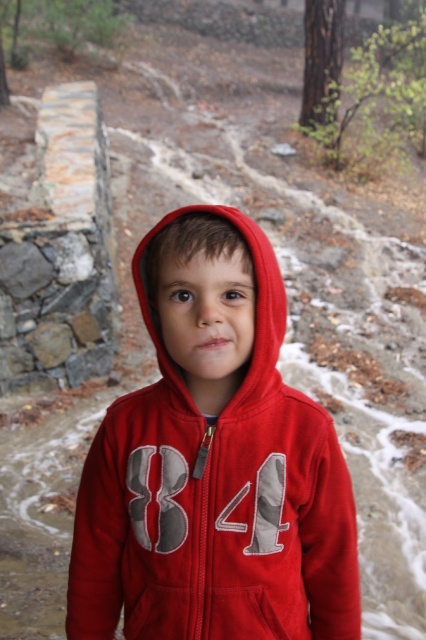
Question: Which of the following is the closest to the observer?

Choices:
 (A) matte fleece hoodie at center
 (B) red fleece hoodie at center

Answer: (A)

Question: Does matte fleece hoodie at center appear on the right side of red fleece hoodie at center?

Choices:
 (A) yes
 (B) no

Answer: (B)

Question: Can you confirm if matte fleece hoodie at center is wider than red fleece hoodie at center?

Choices:
 (A) yes
 (B) no

Answer: (A)

Question: Is matte fleece hoodie at center further to the viewer compared to red fleece hoodie at center?

Choices:
 (A) yes
 (B) no

Answer: (B)